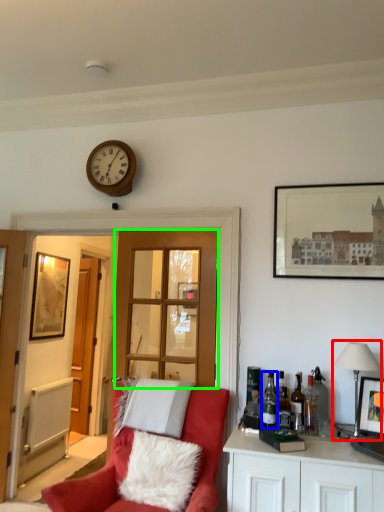
Question: Considering the real-world distances, which object is closest to lamp (highlighted by a red box)? bottle (highlighted by a blue box) or glass door (highlighted by a green box).

Choices:
 (A) bottle
 (B) glass door

Answer: (A)